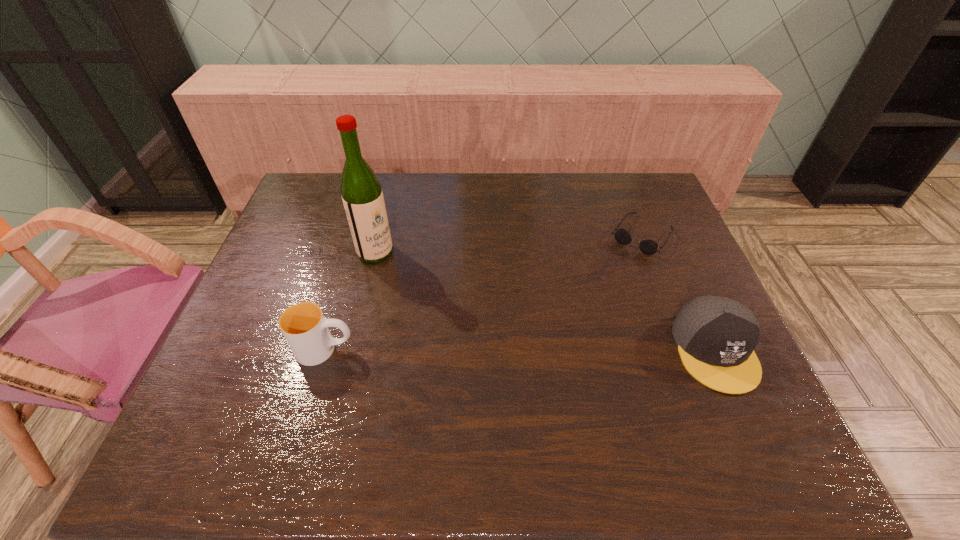
Image resolution: width=960 pixels, height=540 pixels. I want to click on vacant region between the cap and the cup, so click(520, 350).

Find the location of `free space between the cap and the liquor`. free space between the cap and the liquor is located at coordinates (545, 301).

I want to click on free spot between the sunglasses and the liquor, so click(509, 244).

The height and width of the screenshot is (540, 960). What are the coordinates of `free point between the cup and the liquor` in the screenshot? It's located at pos(350,301).

Identify which object is located as the second nearest to the sunglasses. Please provide its 2D coordinates. Your answer should be formatted as a tuple, i.e. [(x, y)], where the tuple contains the x and y coordinates of a point satisfying the conditions above.

[(362, 196)]

Point out which object is positioned as the nearest to the cap. Please provide its 2D coordinates. Your answer should be formatted as a tuple, i.e. [(x, y)], where the tuple contains the x and y coordinates of a point satisfying the conditions above.

[(649, 247)]

This screenshot has width=960, height=540. What are the coordinates of `vacant area that satisfies the following two spatial constraints: 1. on the back side of the tallest object; 2. on the left side of the sunglasses` in the screenshot? It's located at (379, 236).